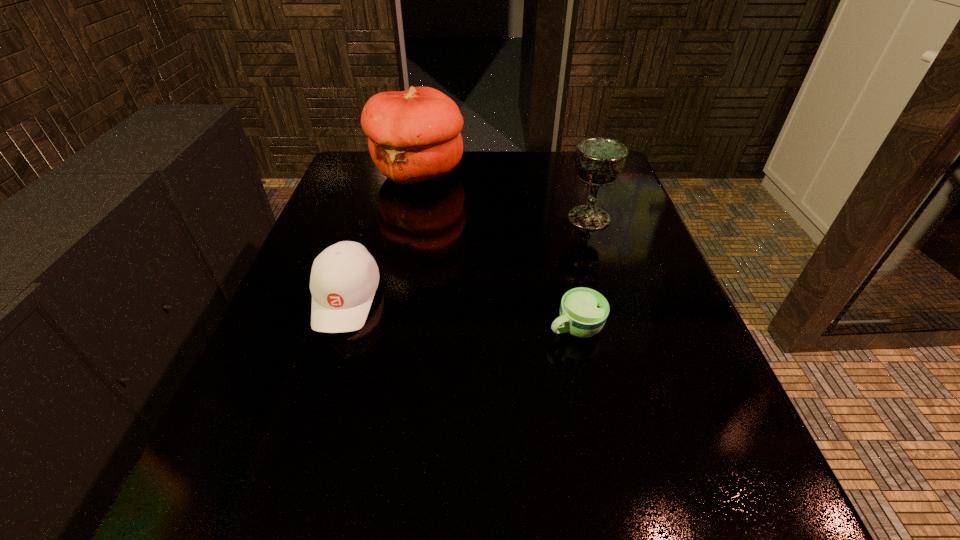
Where is `the tallest object`? Image resolution: width=960 pixels, height=540 pixels. the tallest object is located at coordinates (414, 135).

At what (x,y) coordinates should I click in order to perform the action: click on pumpkin. Please return your answer as a coordinate pair (x, y). Looking at the image, I should click on (414, 135).

You are a GUI agent. You are given a task and a screenshot of the screen. Output one action in this format:
    pyautogui.click(x=<x>, y=<y>)
    Task: Click on the third shortest object
    
    Given the screenshot: What is the action you would take?
    pyautogui.click(x=599, y=161)

You are a GUI agent. You are given a task and a screenshot of the screen. Output one action in this format:
    pyautogui.click(x=<x>, y=<y>)
    Task: Click on the second farthest object
    
    Given the screenshot: What is the action you would take?
    pyautogui.click(x=599, y=161)

You are a GUI agent. You are given a task and a screenshot of the screen. Output one action in this format:
    pyautogui.click(x=<x>, y=<y>)
    Task: Click on the third tallest object
    Image resolution: width=960 pixels, height=540 pixels.
    Given the screenshot: What is the action you would take?
    pyautogui.click(x=344, y=277)

This screenshot has height=540, width=960. I want to click on cup, so click(583, 311).

In order to click on free space located on the right of the tallest object in this screenshot , I will do `click(514, 172)`.

You are a GUI agent. You are given a task and a screenshot of the screen. Output one action in this format:
    pyautogui.click(x=<x>, y=<y>)
    Task: Click on the free space located on the left of the chalice
    Image resolution: width=960 pixels, height=540 pixels.
    Given the screenshot: What is the action you would take?
    pyautogui.click(x=522, y=218)

In order to click on free spot located on the front-facing side of the third tallest object in this screenshot , I will do `click(291, 470)`.

Where is `free space located on the back of the shortest object`? free space located on the back of the shortest object is located at coordinates (550, 210).